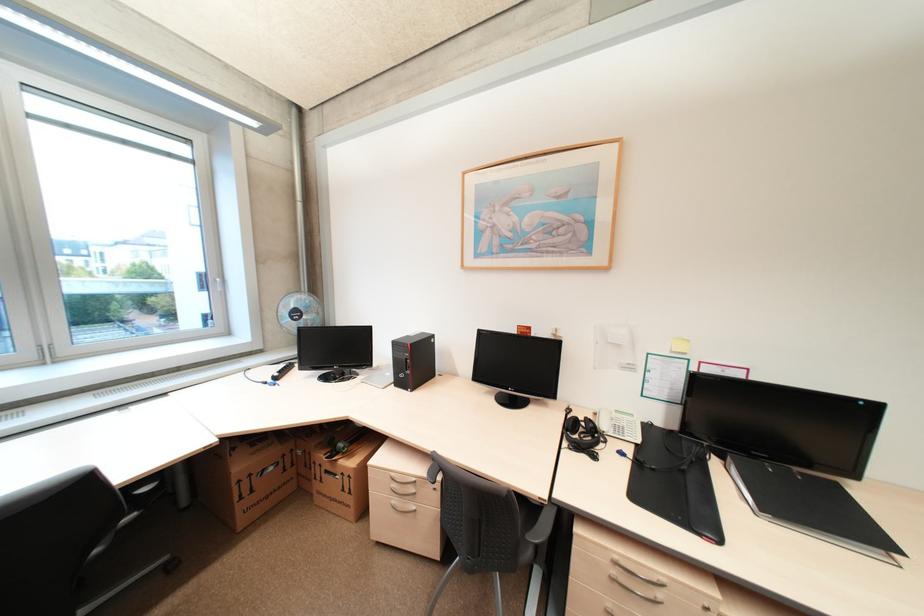
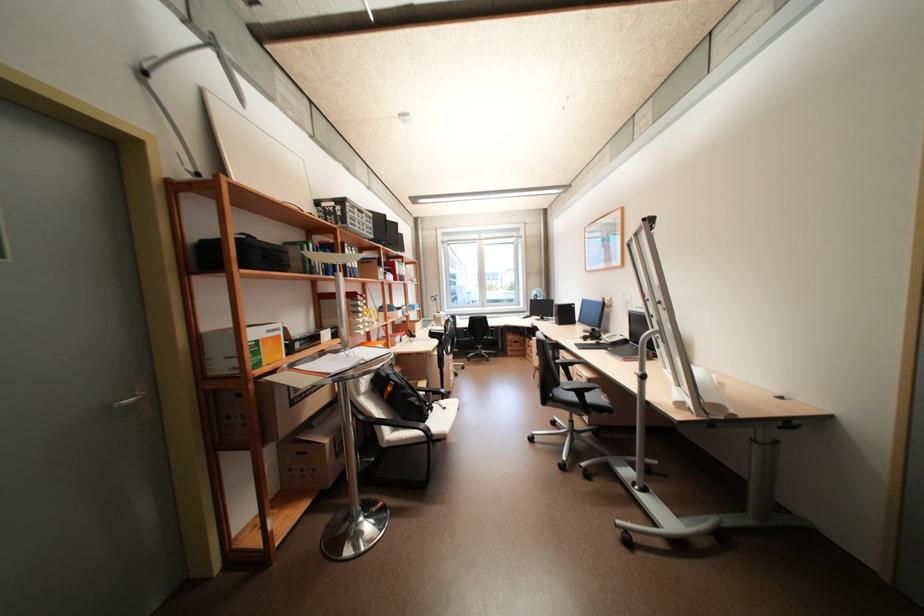
Where in the second image is the point corresponding to point 626,453 from the first image?

(603, 342)